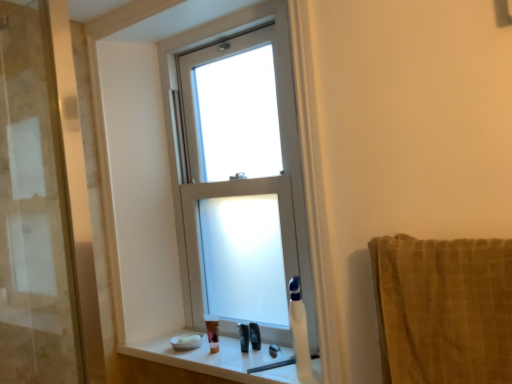
Question: Is point (246, 350) closer or farther from the camera than point (212, 344)?

Choices:
 (A) farther
 (B) closer

Answer: (B)

Question: Is translucent plastic toothbrush at lower center, the second toiletry in the left-to-right sequence, in front of or behind translucent plastic soap at lower center, the 3th toiletry in the right-to-left sequence, in the image?

Choices:
 (A) front
 (B) behind

Answer: (A)

Question: Estimate the real-world distances between objects in this image. Which object is farther from the translucent plastic soap at lower center, acting as the 1th toiletry starting from the left?

Choices:
 (A) white glossy window sill at lower center
 (B) black plastic razor at lower center, which is the 3th toiletry in left-to-right order
 (C) white frosted glass window at center
 (D) white plastic soap dispenser at lower right
 (E) translucent plastic toothbrush at lower center, the second toiletry in the left-to-right sequence

Answer: (C)

Question: Estimate the real-world distances between objects in this image. Which object is farther from the white frosted glass window at center?

Choices:
 (A) brown textured towel at right
 (B) black plastic razor at lower center, marked as the 1th toiletry in a right-to-left arrangement
 (C) translucent plastic toothbrush at lower center, the second toiletry in the left-to-right sequence
 (D) white plastic soap dispenser at lower right
 (E) white glossy window sill at lower center

Answer: (A)